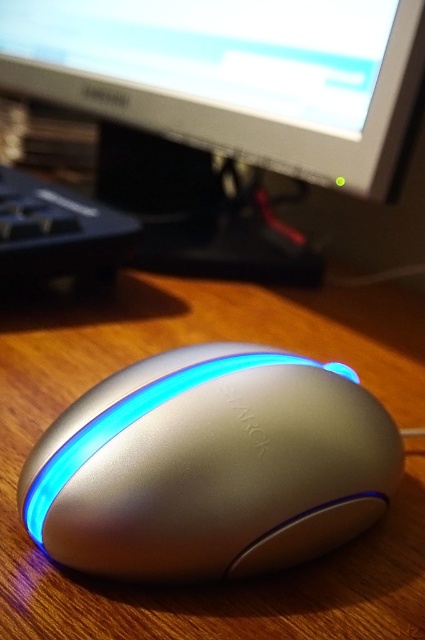
Locate an element on the screen. Image resolution: width=425 pixels, height=640 pixels. matte black monitor at upper center is located at coordinates (226, 109).

Who is higher up, matte black monitor at upper center or black plastic keyboard at lower left?

Positioned higher is matte black monitor at upper center.

Who is more distant from viewer, (124,17) or (6,172)?

The point (6,172) is behind.

Find the location of a particular element. matte black monitor at upper center is located at coordinates pyautogui.click(x=226, y=109).

Looking at this image, which of these two, matte black monitor at upper center or satin silver mouse at center, stands shorter?

satin silver mouse at center

Is point (413, 80) less distant than point (241, 362)?

That is False.

This screenshot has width=425, height=640. Find the location of `matte black monitor at upper center`. matte black monitor at upper center is located at coordinates (226, 109).

Can you confirm if satin silver mouse at center is shorter than black plastic keyboard at lower left?

Indeed, satin silver mouse at center has a lesser height compared to black plastic keyboard at lower left.

You are a GUI agent. You are given a task and a screenshot of the screen. Output one action in this format:
    pyautogui.click(x=<x>, y=<y>)
    Task: Click on the satin silver mouse at center
    The width and height of the screenshot is (425, 640).
    Given the screenshot: What is the action you would take?
    pyautogui.click(x=210, y=465)